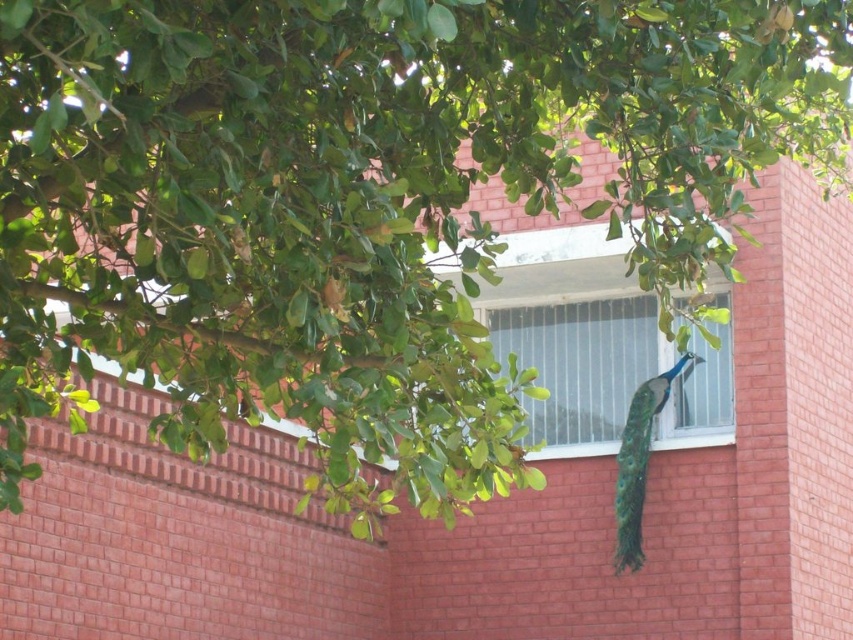
You are a photographer trying to capture the green iridescent peacock at center and the shiny green peacock tail at center in a single frame. Based on their sizes, which one should you focus on to ensure both are clearly visible?

The green iridescent peacock at center is larger than the shiny green peacock tail at center, so focusing on the green iridescent peacock at center will help ensure both are clearly visible in the frame.

In the scene shown: You are a photographer trying to capture the green iridescent peacock at center and the shiny green peacock tail at center in a single shot. Which object will appear closer to the camera in the photo?

The green iridescent peacock at center will appear closer to the camera because the shiny green peacock tail at center is positioned behind it.

You are standing outside a building and see the clear glass window at center and the green iridescent peacock at center. Which object is closer to you?

The clear glass window at center is closer to you because the green iridescent peacock at center is behind it.